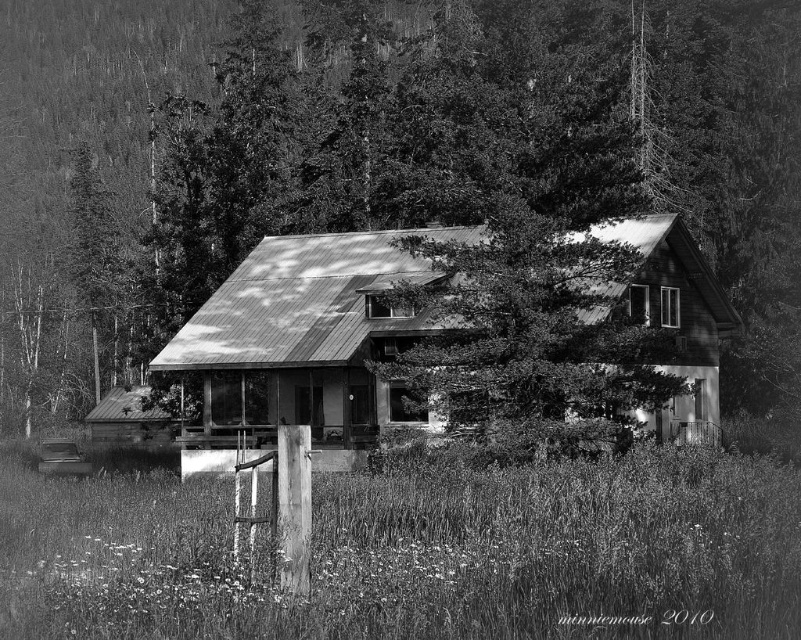
Question: Can you confirm if smooth bark tree at center is positioned to the right of rusty metal cabin at center?

Choices:
 (A) no
 (B) yes

Answer: (A)

Question: Which object appears farthest from the camera in this image?

Choices:
 (A) smooth bark tree at center
 (B) rusty metal cabin at center

Answer: (A)

Question: Which object appears closest to the camera in this image?

Choices:
 (A) rusty metal cabin at center
 (B) smooth bark tree at center

Answer: (A)

Question: Where is smooth bark tree at center located in relation to rusty metal cabin at center in the image?

Choices:
 (A) below
 (B) above

Answer: (B)

Question: Can you confirm if smooth bark tree at center is wider than rusty metal cabin at center?

Choices:
 (A) no
 (B) yes

Answer: (B)